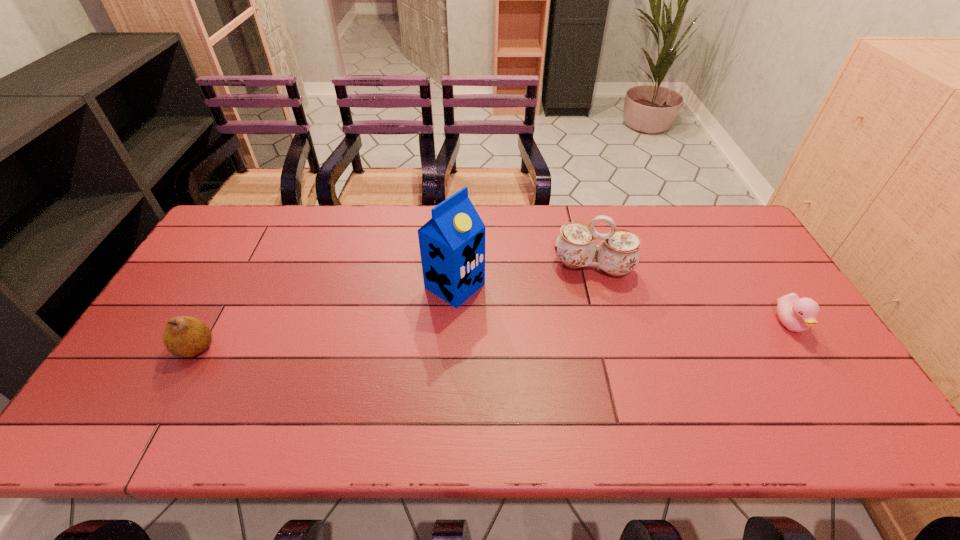
The width and height of the screenshot is (960, 540). What are the coordinates of `vacant space at the near edge of the desktop` in the screenshot? It's located at (369, 381).

You are a GUI agent. You are given a task and a screenshot of the screen. Output one action in this format:
    pyautogui.click(x=<x>, y=<y>)
    Task: Click on the vacant area at the left edge of the desktop
    The width and height of the screenshot is (960, 540).
    Given the screenshot: What is the action you would take?
    pyautogui.click(x=228, y=264)

In the image, there is a desktop. Identify the location of blank space at the right edge. Image resolution: width=960 pixels, height=540 pixels. coord(766,313).

At what (x,y) coordinates should I click in order to perform the action: click on free space at the far left corner of the desktop. Please return your answer as a coordinate pair (x, y). This screenshot has height=540, width=960. Looking at the image, I should click on (232, 217).

This screenshot has height=540, width=960. In order to click on vacant space at the near left corner in this screenshot , I will do `click(177, 375)`.

This screenshot has height=540, width=960. Identify the location of vacant space at the near right corner. (785, 388).

You are a GUI agent. You are given a task and a screenshot of the screen. Output one action in this format:
    pyautogui.click(x=<x>, y=<y>)
    Task: Click on the unoccupied area between the third tallest object and the shortest object
    This screenshot has height=540, width=960.
    Given the screenshot: What is the action you would take?
    pyautogui.click(x=492, y=335)

The width and height of the screenshot is (960, 540). What are the coordinates of `vacant space that is in between the carton and the pear` in the screenshot? It's located at (325, 316).

Find the location of a particular element. empty space between the pear and the chinaware is located at coordinates (395, 307).

At what (x,y) coordinates should I click in order to perform the action: click on unoccupied area between the third shortest object and the pear. Please return your answer as a coordinate pair (x, y). The width and height of the screenshot is (960, 540). Looking at the image, I should click on (395, 307).